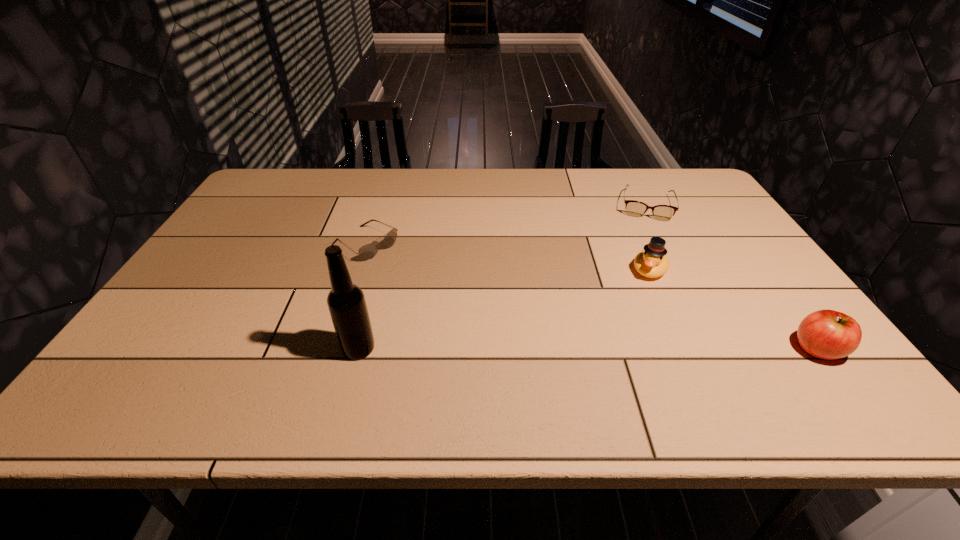
I want to click on spectacles at the right edge, so click(634, 208).

Identify the location of object that is at the far right corner. (634, 208).

You are a GUI agent. You are given a task and a screenshot of the screen. Output one action in this format:
    pyautogui.click(x=<x>, y=<y>)
    Task: Click on the object located at the near right corner
    
    Given the screenshot: What is the action you would take?
    pyautogui.click(x=827, y=334)

Locate an element on the screen. The image size is (960, 540). vacant position at the far edge of the desktop is located at coordinates (517, 199).

Locate an element on the screen. This screenshot has width=960, height=540. blank area at the near edge is located at coordinates (291, 348).

Locate an element on the screen. free point at the left edge is located at coordinates (250, 231).

In the image, there is a desktop. Identify the location of vacant space at the right edge. The width and height of the screenshot is (960, 540). (781, 315).

In the image, there is a desktop. At what (x,y) coordinates should I click in order to perform the action: click on vacant space at the near right corner. Please return your answer as a coordinate pair (x, y). Looking at the image, I should click on (804, 355).

The width and height of the screenshot is (960, 540). What are the coordinates of `unoccupied area between the tallest object and the farthest object` in the screenshot? It's located at (502, 277).

Image resolution: width=960 pixels, height=540 pixels. What are the coordinates of `free space that is in between the sunglasses and the farthest object` in the screenshot? It's located at (506, 225).